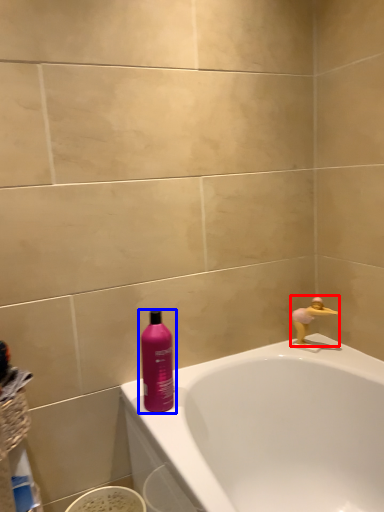
Question: Which of the following is the closest to the observer, faucet (highlighted by a red box) or bottle (highlighted by a blue box)?

Choices:
 (A) faucet
 (B) bottle

Answer: (B)